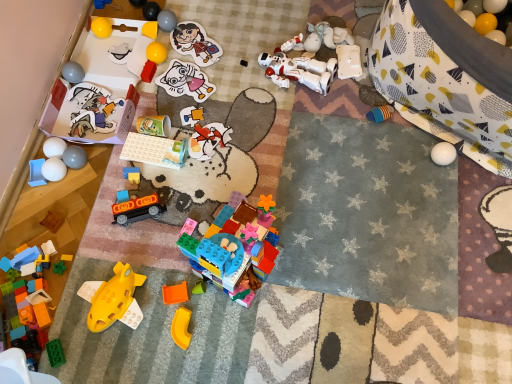
Identify the location of vacant area that is in front of matte blue plastic toy at center, marked as the thirteenth toy in a right-to-left arrangement. (126, 231).